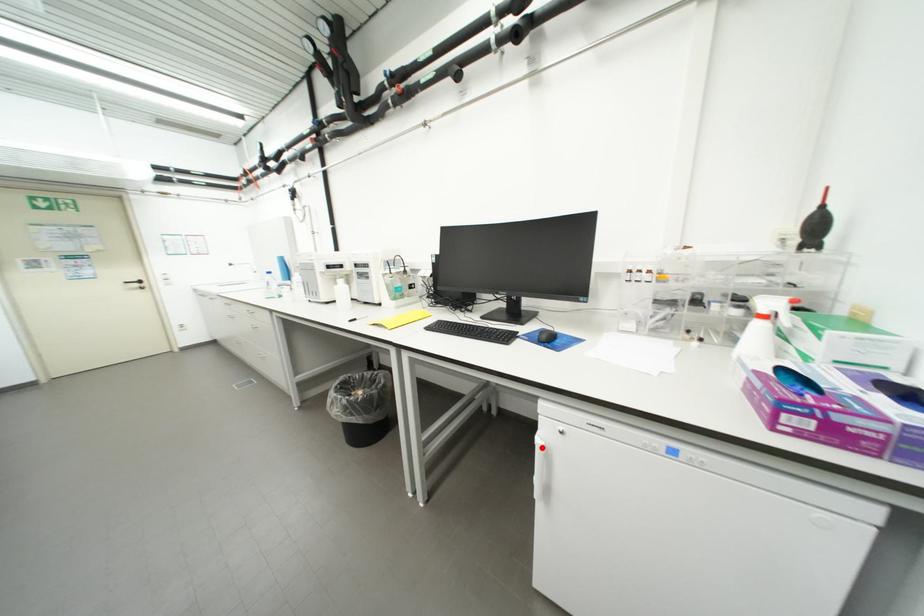
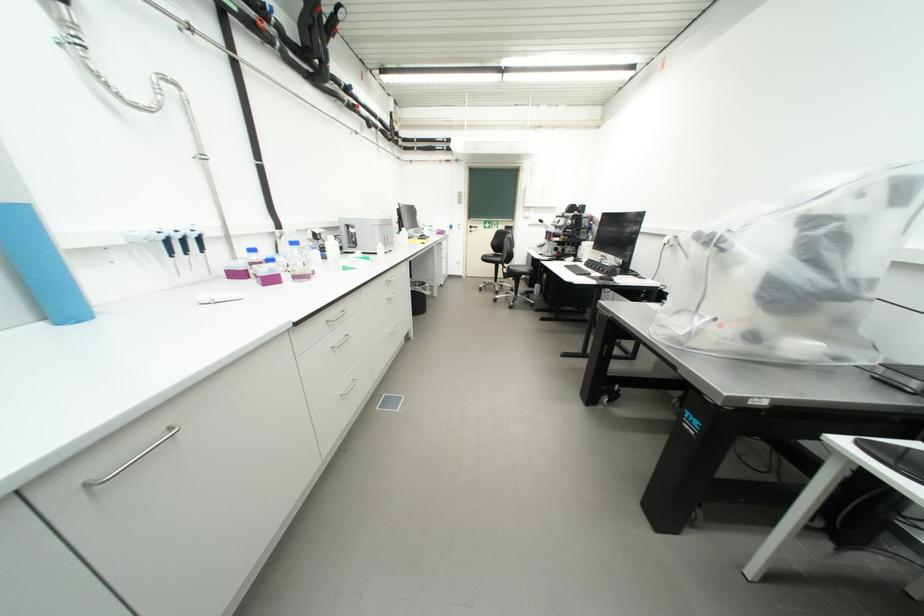
Question: I am providing you with two images of the same scene from different viewpoints. A red point is marked on the first image. Can you still see the location of the red point in image 2?

Choices:
 (A) Yes
 (B) No

Answer: (B)